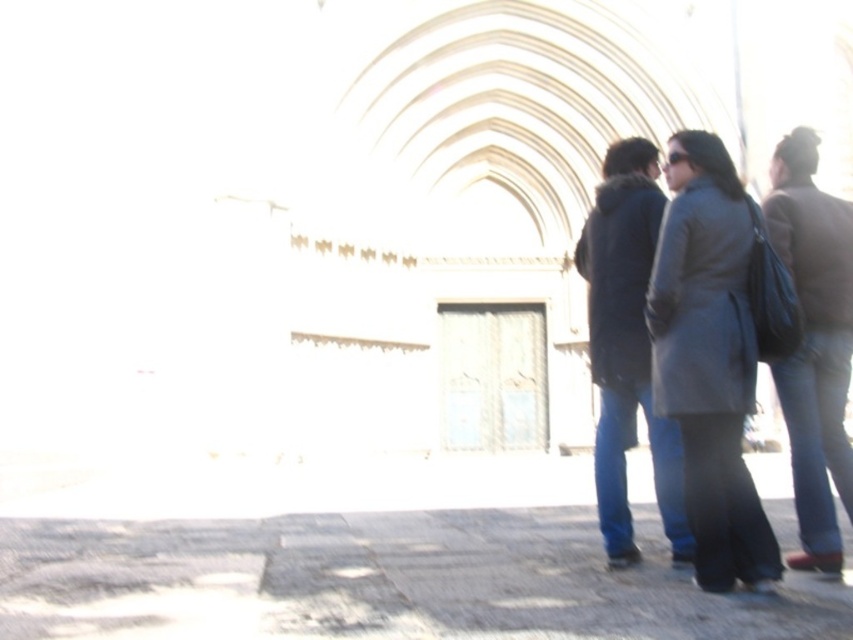
Question: Does gray stone pavement at lower center appear over dark gray coat at right?

Choices:
 (A) no
 (B) yes

Answer: (A)

Question: Where is gray stone pavement at lower center located in relation to dark gray coat at right in the image?

Choices:
 (A) above
 (B) below

Answer: (B)

Question: Is gray stone pavement at lower center wider than dark gray coat at right?

Choices:
 (A) yes
 (B) no

Answer: (A)

Question: Which object is closer to the camera taking this photo?

Choices:
 (A) gray stone pavement at lower center
 (B) dark gray coat at right

Answer: (A)

Question: Which of the following is the farthest from the observer?

Choices:
 (A) dark gray coat at right
 (B) gray stone pavement at lower center

Answer: (A)